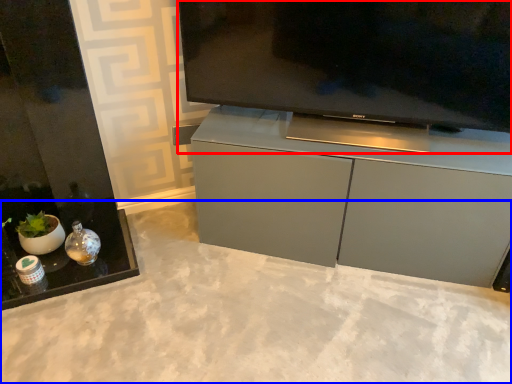
Question: Which point is further to the camera, television (highlighted by a red box) or concrete (highlighted by a blue box)?

Choices:
 (A) television
 (B) concrete

Answer: (A)